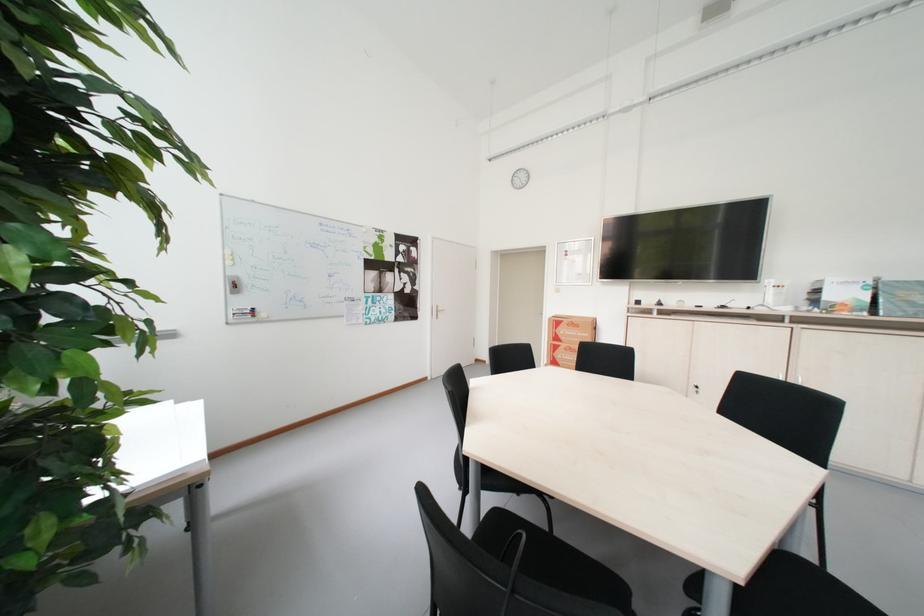
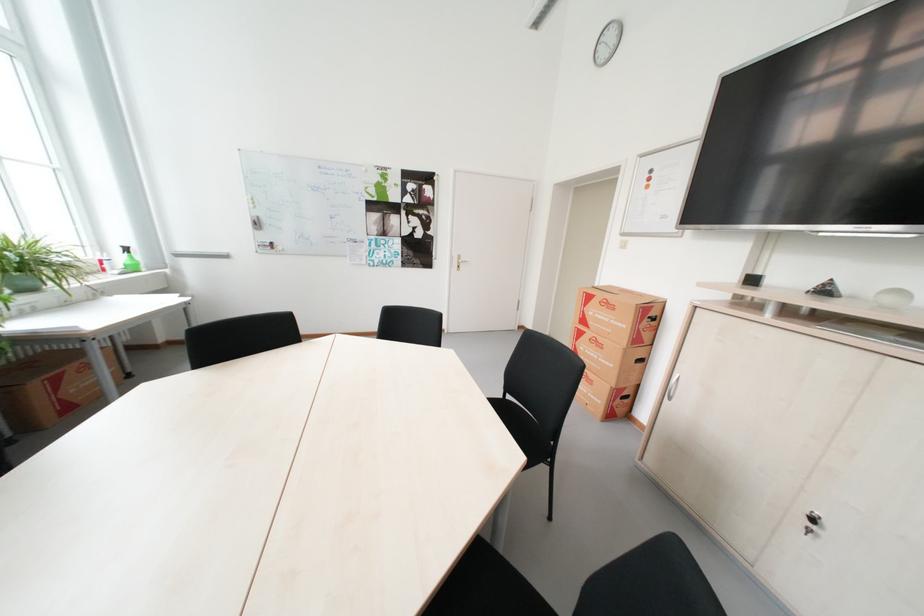
Locate, in the second image, the point that corresponds to (690,302) in the first image.

(910, 294)